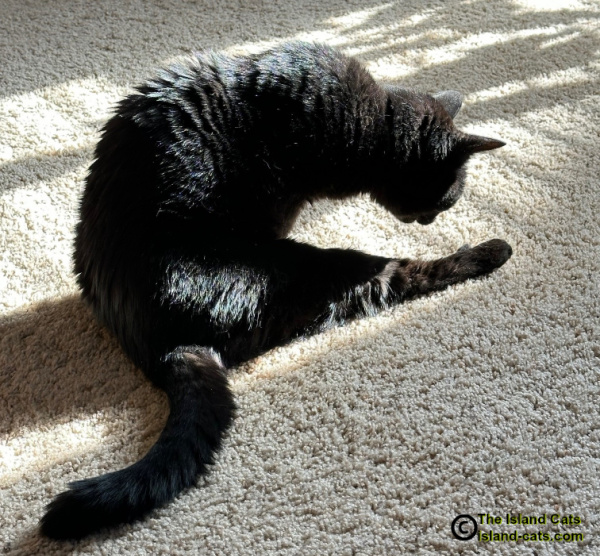
The width and height of the screenshot is (600, 556). Identify the location of carpet. (402, 491).